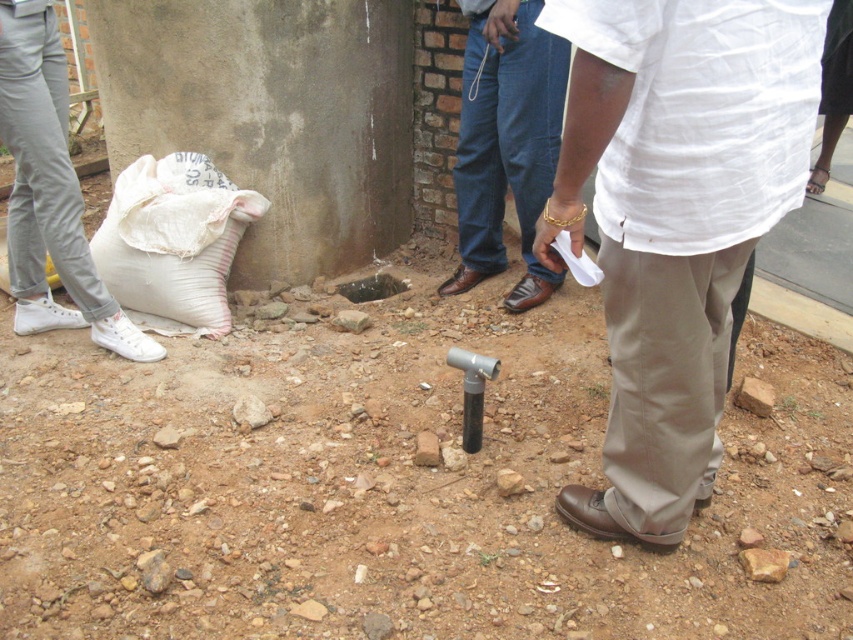
You are a worker standing at the camera position in the construction site scene. You need to pick up the denim jeans at center. Is it within your immediate reach without moving your feet?

The denim jeans at center is 2.52 meters away from the camera, so it is too far to reach without moving your feet. You will need to take a few steps forward to grab it.